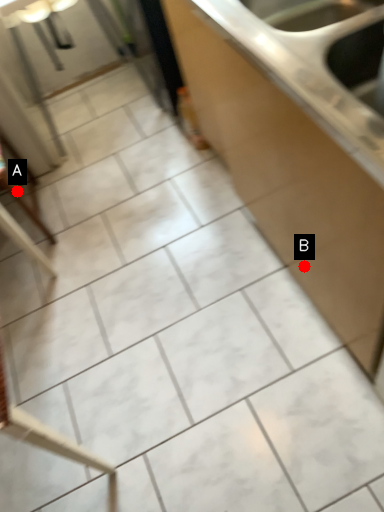
Question: Two points are circled on the image, labeled by A and B beside each circle. Among these points, which one is farthest from the camera?

Choices:
 (A) A is further
 (B) B is further

Answer: (A)